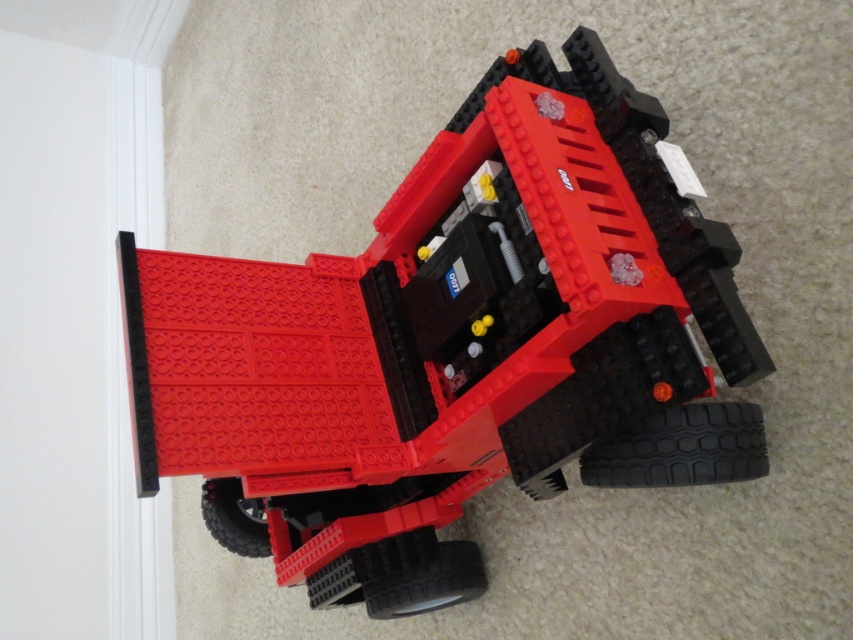
Does matte plastic toy car at center appear on the left side of black rubber tire at lower right?

Correct, you'll find matte plastic toy car at center to the left of black rubber tire at lower right.

Can you confirm if matte plastic toy car at center is bigger than black rubber tire at lower right?

Correct, matte plastic toy car at center is larger in size than black rubber tire at lower right.

Does point (474, 102) come behind point (699, 435)?

Yes.

Find the location of a particular element. matte plastic toy car at center is located at coordinates (442, 330).

What do you see at coordinates (442, 330) in the screenshot? This screenshot has height=640, width=853. I see `matte plastic toy car at center` at bounding box center [442, 330].

Does matte plastic toy car at center appear on the left side of black rubber tire at lower center?

Yes, matte plastic toy car at center is to the left of black rubber tire at lower center.

What are the coordinates of `matte plastic toy car at center` in the screenshot? It's located at (442, 330).

The image size is (853, 640). I want to click on matte plastic toy car at center, so click(x=442, y=330).

Locate an element on the screen. matte plastic toy car at center is located at coordinates (442, 330).

Describe the element at coordinates (442, 330) in the screenshot. I see `matte plastic toy car at center` at that location.

The image size is (853, 640). I want to click on matte plastic toy car at center, so click(442, 330).

The width and height of the screenshot is (853, 640). In order to click on matte plastic toy car at center in this screenshot , I will do `click(442, 330)`.